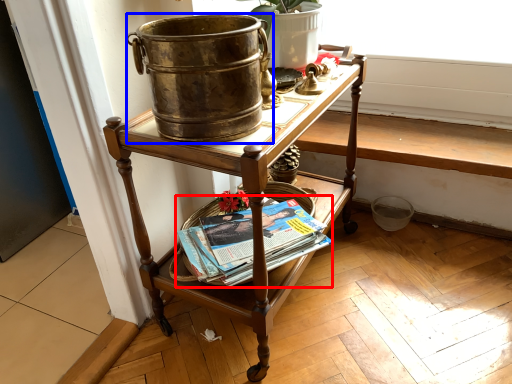
Question: Which point is closer to the camera, paperback book (highlighted by a red box) or flowerpot (highlighted by a blue box)?

Choices:
 (A) paperback book
 (B) flowerpot

Answer: (B)